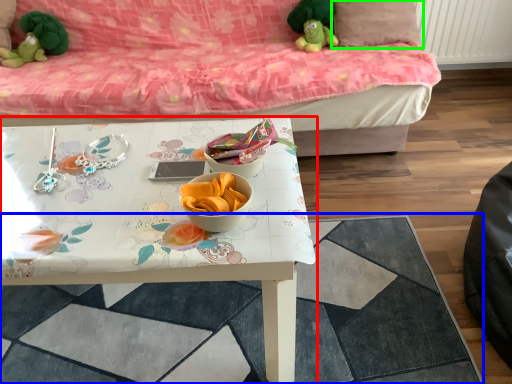
Question: Considering the real-world distances, which object is closest to table (highlighted by a red box)? tile (highlighted by a blue box) or pillow (highlighted by a green box).

Choices:
 (A) tile
 (B) pillow

Answer: (A)